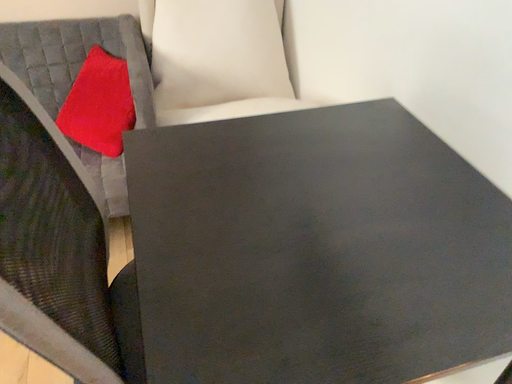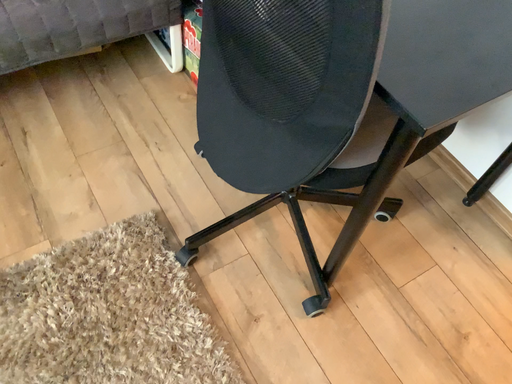
Question: How did the camera likely rotate when shooting the video?

Choices:
 (A) rotated right
 (B) rotated left

Answer: (A)